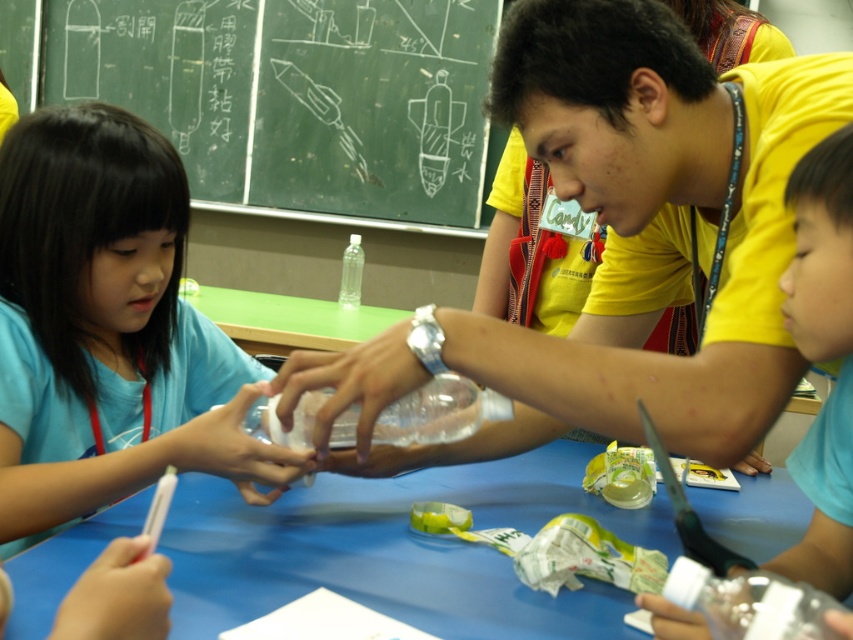
Question: Is matte blue shirt at left below white chalkboard at upper left?

Choices:
 (A) yes
 (B) no

Answer: (A)

Question: Which point appears farthest from the camera in this image?

Choices:
 (A) (672, 602)
 (B) (280, 468)
 (C) (242, 508)

Answer: (C)

Question: Among these objects, which one is nearest to the camera?

Choices:
 (A) transparent plastic bottle at center
 (B) matte blue shirt at left
 (C) transparent plastic bottle at lower right

Answer: (C)

Question: Which of the following is the closest to the observer?

Choices:
 (A) translucent plastic bottle at right
 (B) matte blue shirt at left
 (C) transparent plastic bottle at lower right

Answer: (C)

Question: Does matte blue shirt at left have a lesser width compared to translucent plastic bottle at right?

Choices:
 (A) no
 (B) yes

Answer: (A)

Question: Does matte blue shirt at left have a greater width compared to blue plastic table at center?

Choices:
 (A) no
 (B) yes

Answer: (A)